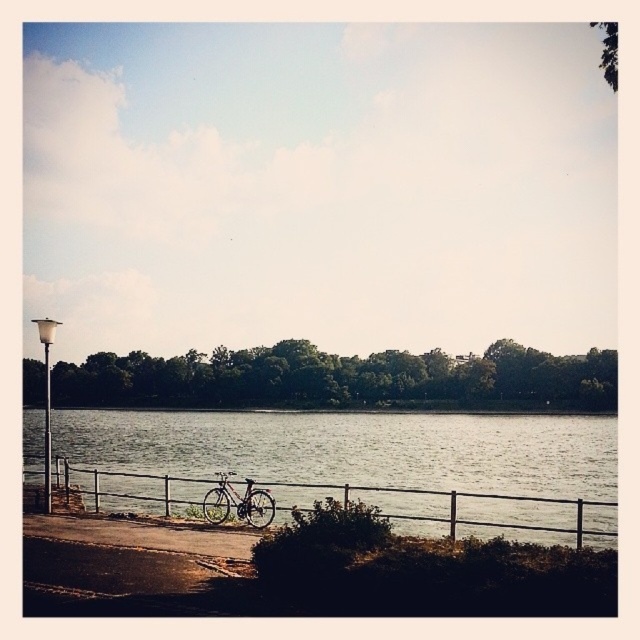
You are a pedestrian walking along the riverside path and want to know if you can fit a picnic basket between the metallic silver fence at lower center and the white glossy lamp post at left. Can you determine if there is enough space?

The metallic silver fence at lower center has a smaller size compared to white glossy lamp post at left, but without knowing the exact dimensions of the picnic basket or the distance between them, it is difficult to determine if there is enough space.